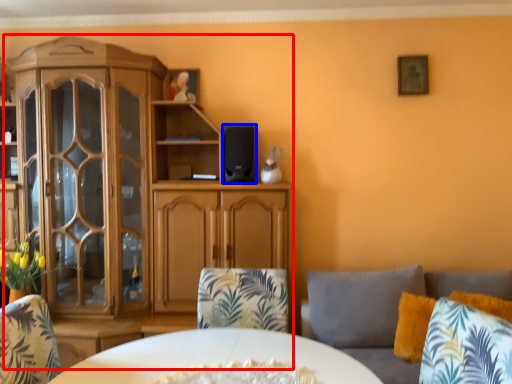
Question: Which object appears farthest to the camera in this image, cabinetry (highlighted by a red box) or speaker (highlighted by a blue box)?

Choices:
 (A) cabinetry
 (B) speaker

Answer: (B)